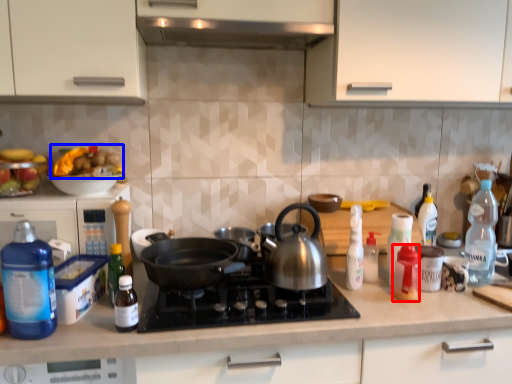
Question: Which of the following is the farthest to the observer, bottle (highlighted by a red box) or food (highlighted by a blue box)?

Choices:
 (A) bottle
 (B) food

Answer: (B)